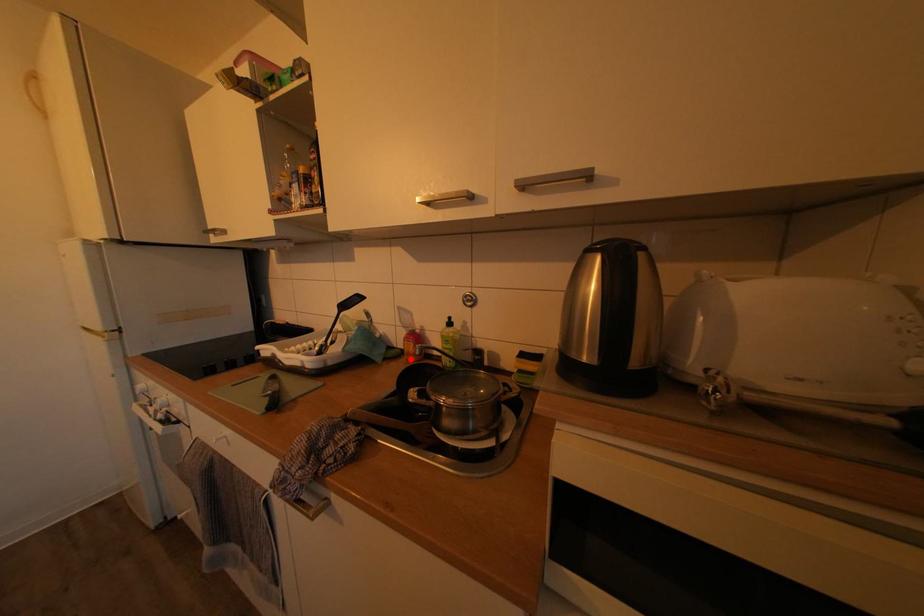
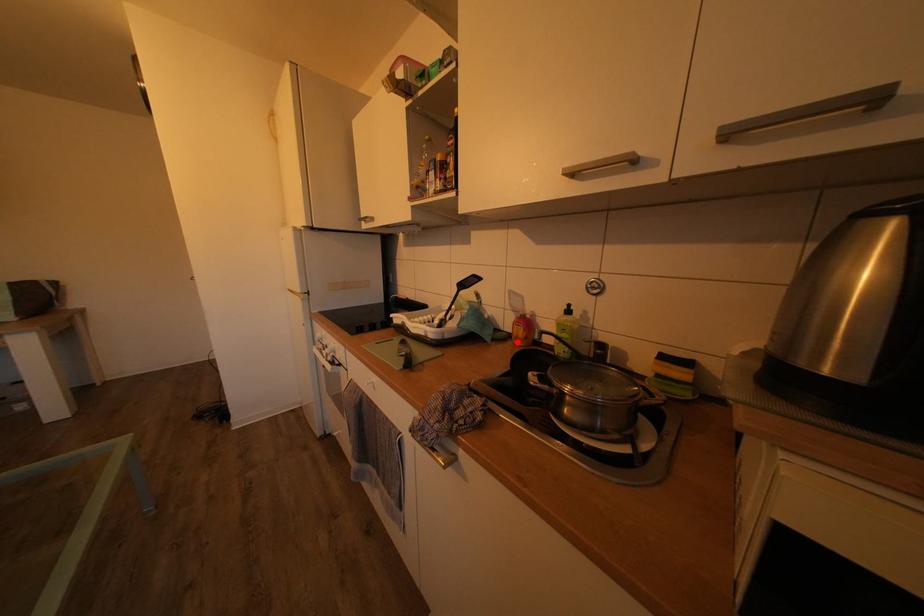
I am providing you with two images of the same scene from different viewpoints. A red point is marked on the first image and another point is marked on the second image. Is the marked point in image1 the same physical position as the marked point in image2?

Yes